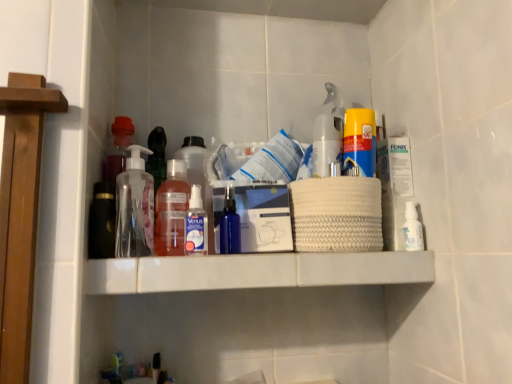
The height and width of the screenshot is (384, 512). I want to click on empty space that is to the right of clear plastic spray bottle at center, the fourth bottle viewed from the left, so click(276, 253).